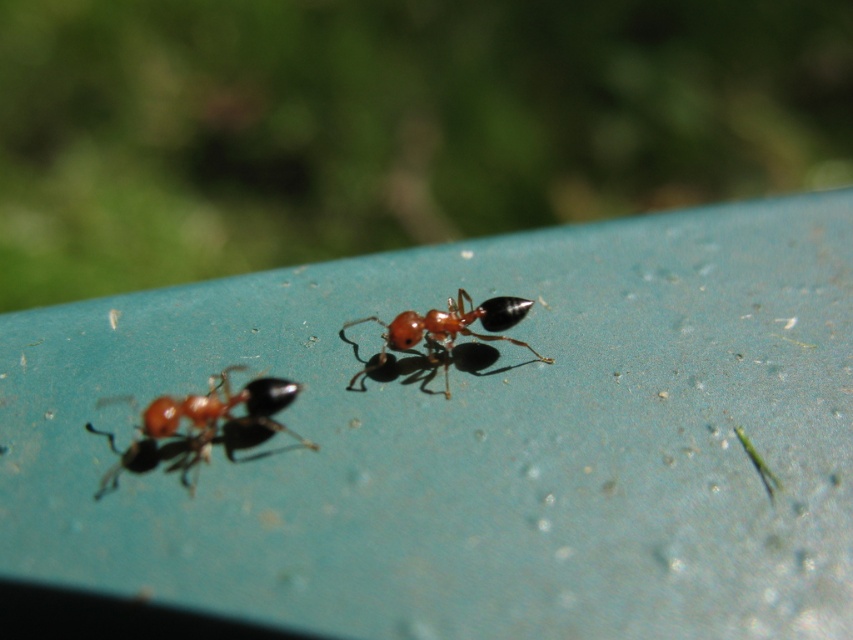
Question: Among these points, which one is nearest to the camera?

Choices:
 (A) (180, 461)
 (B) (490, 316)

Answer: (A)

Question: Which point is closer to the camera?

Choices:
 (A) shiny orange ant at lower left
 (B) shiny red ant at center

Answer: (A)

Question: Can you confirm if shiny orange ant at lower left is wider than shiny red ant at center?

Choices:
 (A) yes
 (B) no

Answer: (B)

Question: Is shiny orange ant at lower left wider than shiny red ant at center?

Choices:
 (A) yes
 (B) no

Answer: (B)

Question: Does shiny orange ant at lower left have a larger size compared to shiny red ant at center?

Choices:
 (A) yes
 (B) no

Answer: (A)